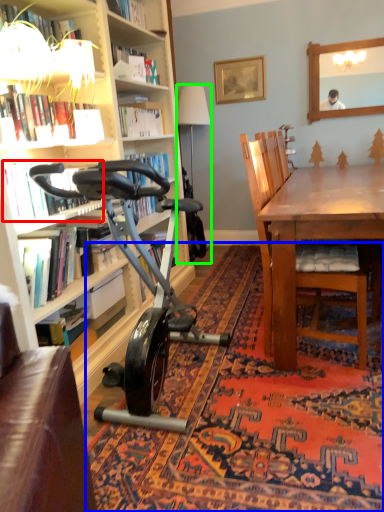
Question: Considering the real-world distances, which object is farthest from book (highlighted by a red box)? mat (highlighted by a blue box) or lamp (highlighted by a green box)?

Choices:
 (A) mat
 (B) lamp

Answer: (B)